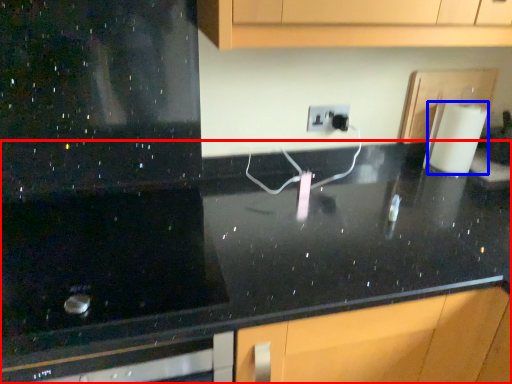
Question: Which point is further to the camera, countertop (highlighted by a red box) or paper towel (highlighted by a blue box)?

Choices:
 (A) countertop
 (B) paper towel

Answer: (B)